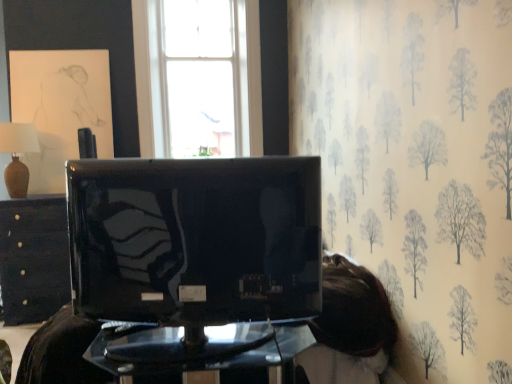
Question: Does transparent glass table at center, marked as the 2th furniture in a left-to-right arrangement, lie behind black glossy drawer at left, which is the 1th furniture from left to right?

Choices:
 (A) yes
 (B) no

Answer: (B)

Question: Considering the relative sizes of transparent glass table at center, marked as the 2th furniture in a left-to-right arrangement, and black glossy drawer at left, marked as the second furniture in a right-to-left arrangement, in the image provided, is transparent glass table at center, marked as the 2th furniture in a left-to-right arrangement, bigger than black glossy drawer at left, marked as the second furniture in a right-to-left arrangement,?

Choices:
 (A) no
 (B) yes

Answer: (A)

Question: From a real-world perspective, is transparent glass table at center, which is the 1th furniture in front-to-back order, under black glossy drawer at left, which is the 1th furniture from left to right?

Choices:
 (A) no
 (B) yes

Answer: (B)

Question: Is transparent glass table at center, the first furniture from the right, to the right of black glossy drawer at left, placed as the 1th furniture when sorted from back to front, from the viewer's perspective?

Choices:
 (A) no
 (B) yes

Answer: (B)

Question: Is transparent glass table at center, which is the 2th furniture in back-to-front order, outside of black glossy drawer at left, marked as the second furniture in a right-to-left arrangement?

Choices:
 (A) yes
 (B) no

Answer: (A)

Question: Is matte beige vase at left bigger or smaller than transparent glass table at center, the first furniture from the right?

Choices:
 (A) small
 (B) big

Answer: (A)

Question: From the image's perspective, relative to transparent glass table at center, marked as the 2th furniture in a left-to-right arrangement, is matte beige vase at left above or below?

Choices:
 (A) below
 (B) above

Answer: (B)

Question: Relative to transparent glass table at center, the first furniture from the right, is matte beige vase at left in front or behind?

Choices:
 (A) front
 (B) behind

Answer: (B)

Question: Considering the positions of point (6, 132) and point (227, 365), is point (6, 132) closer or farther from the camera than point (227, 365)?

Choices:
 (A) closer
 (B) farther

Answer: (B)

Question: Looking at the image, does transparent glass table at center, which is the 2th furniture in back-to-front order, seem bigger or smaller compared to black glossy drawer at left, placed as the 1th furniture when sorted from back to front?

Choices:
 (A) big
 (B) small

Answer: (B)

Question: Which is correct: transparent glass table at center, which is the 2th furniture in back-to-front order, is inside black glossy drawer at left, the second furniture viewed from the front, or outside of it?

Choices:
 (A) inside
 (B) outside

Answer: (B)

Question: Is point (123, 342) positioned closer to the camera than point (36, 238)?

Choices:
 (A) closer
 (B) farther

Answer: (A)

Question: From a real-world perspective, is transparent glass table at center, the first furniture from the right, positioned above or below black glossy drawer at left, marked as the second furniture in a right-to-left arrangement?

Choices:
 (A) above
 (B) below

Answer: (B)

Question: Considering their positions, is matte black television at center located in front of or behind matte beige vase at left?

Choices:
 (A) behind
 (B) front

Answer: (B)

Question: Is matte black television at center wider or thinner than matte beige vase at left?

Choices:
 (A) thin
 (B) wide

Answer: (A)